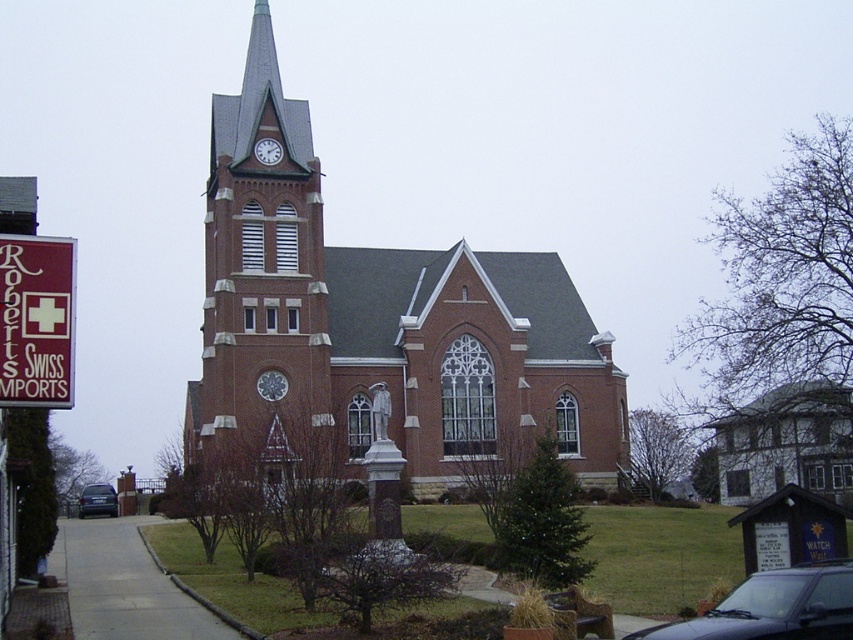
You are a visitor standing in front of the church. You notice the brick steeple at center and the maroon fabric sign at left. Which object is taller?

The brick steeple at center is much taller than the maroon fabric sign at left.